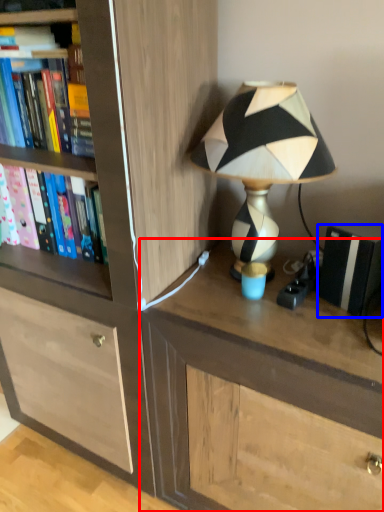
Question: Among these objects, which one is farthest to the camera, desk (highlighted by a red box) or paperback book (highlighted by a blue box)?

Choices:
 (A) desk
 (B) paperback book

Answer: (B)